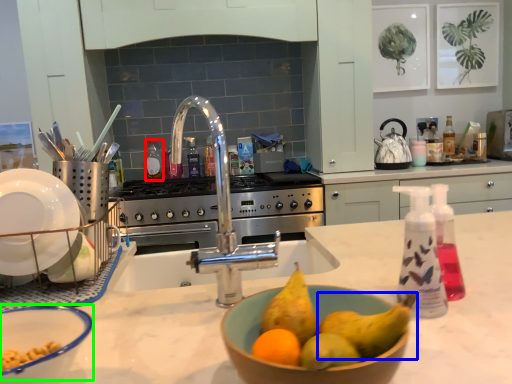
Question: Which is farther away from bottle (highlighted by a red box)? pear (highlighted by a blue box) or basin (highlighted by a green box)?

Choices:
 (A) pear
 (B) basin

Answer: (A)